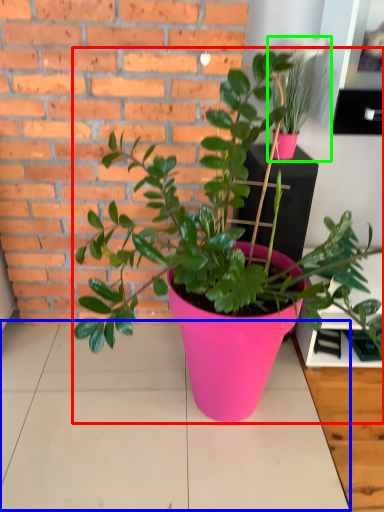
Question: Estimate the real-world distances between objects in this image. Which object is closer to houseplant (highlighted by a red box), table top (highlighted by a blue box) or houseplant (highlighted by a green box)?

Choices:
 (A) table top
 (B) houseplant

Answer: (A)